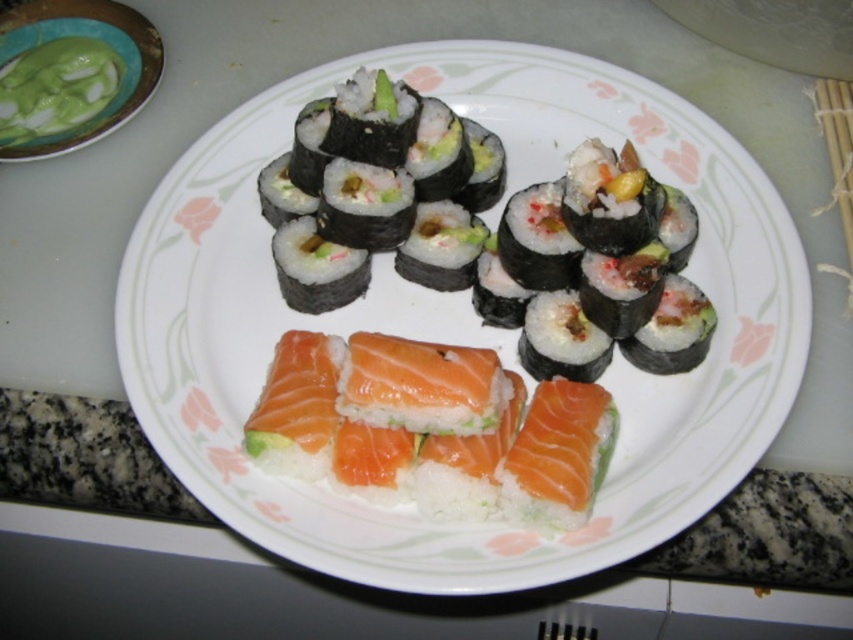
Question: Is white glossy plate at center positioned at the back of green matte bowl at upper left?

Choices:
 (A) yes
 (B) no

Answer: (B)

Question: Is black nori wrapped sushi at center positioned before green matte bowl at upper left?

Choices:
 (A) yes
 (B) no

Answer: (A)

Question: Where is white glossy plate at center located in relation to green matte bowl at upper left in the image?

Choices:
 (A) above
 (B) below

Answer: (B)

Question: Estimate the real-world distances between objects in this image. Which object is closer to the black nori wrapped sushi at center?

Choices:
 (A) white glossy plate at center
 (B) green matte bowl at upper left

Answer: (A)

Question: Which of these objects is positioned closest to the white glossy plate at center?

Choices:
 (A) black nori wrapped sushi at center
 (B) green matte bowl at upper left

Answer: (A)

Question: Among these points, which one is farthest from the camera?

Choices:
 (A) (20, 51)
 (B) (784, 310)
 (C) (409, 177)

Answer: (A)